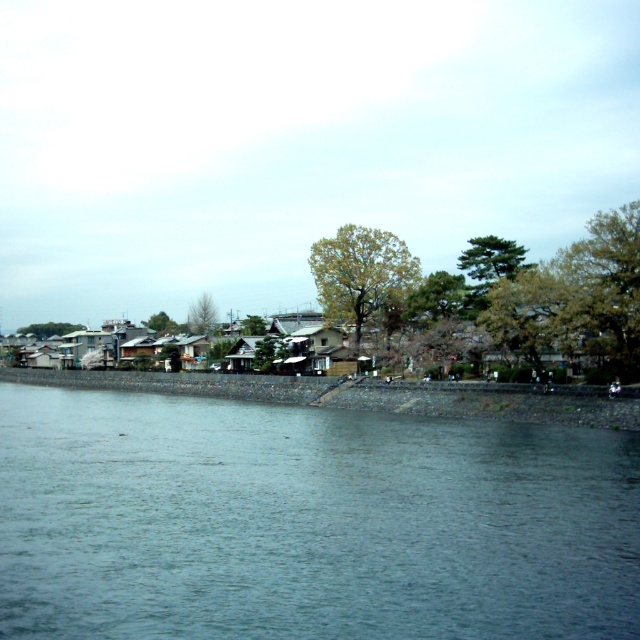
Looking at this image, you are standing on the smooth concrete shoreline at lower center and want to reach the blue water at center. Is the water above or below your current position?

The blue water at center is above the smooth concrete shoreline at lower center, so the water is higher than your current position.

You are standing at the riverside and want to place a small decorative rock on the edge closest to you. Which object should you place it on, the blue water at center or the smooth concrete shoreline at lower center?

You should place the decorative rock on the smooth concrete shoreline at lower center because the blue water at center is shorter than the shoreline, meaning the shoreline is closer to you.